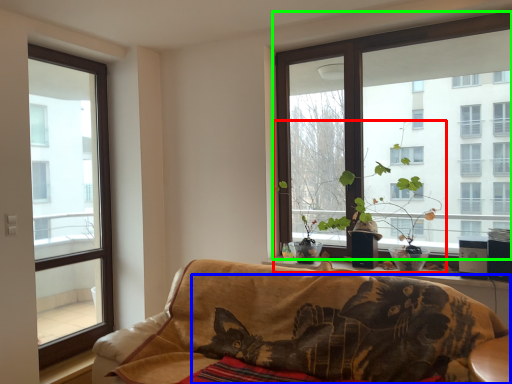
Question: Based on their relative distances, which object is farther from houseplant (highlighted by a red box)? Choose from cat (highlighted by a blue box) and window (highlighted by a green box).

Choices:
 (A) cat
 (B) window

Answer: (A)